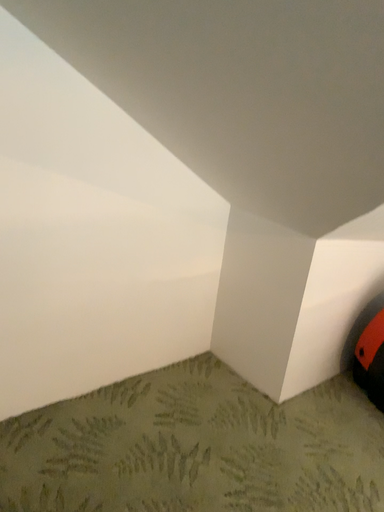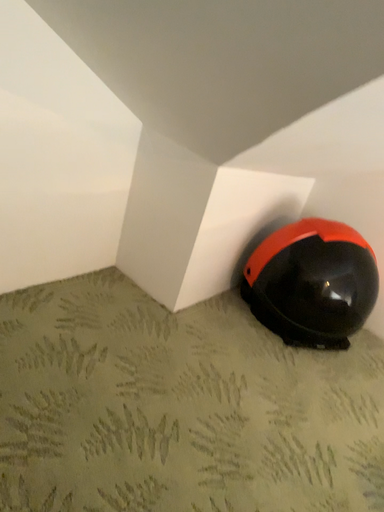
Question: Which way did the camera rotate in the video?

Choices:
 (A) rotated downward
 (B) rotated upward

Answer: (A)